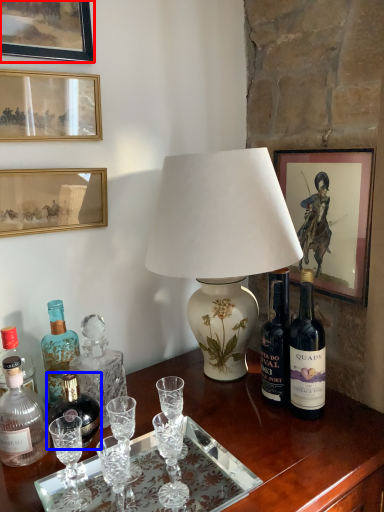
Question: Which object appears farthest to the camera in this image, picture frame (highlighted by a red box) or bottle (highlighted by a blue box)?

Choices:
 (A) picture frame
 (B) bottle

Answer: (B)